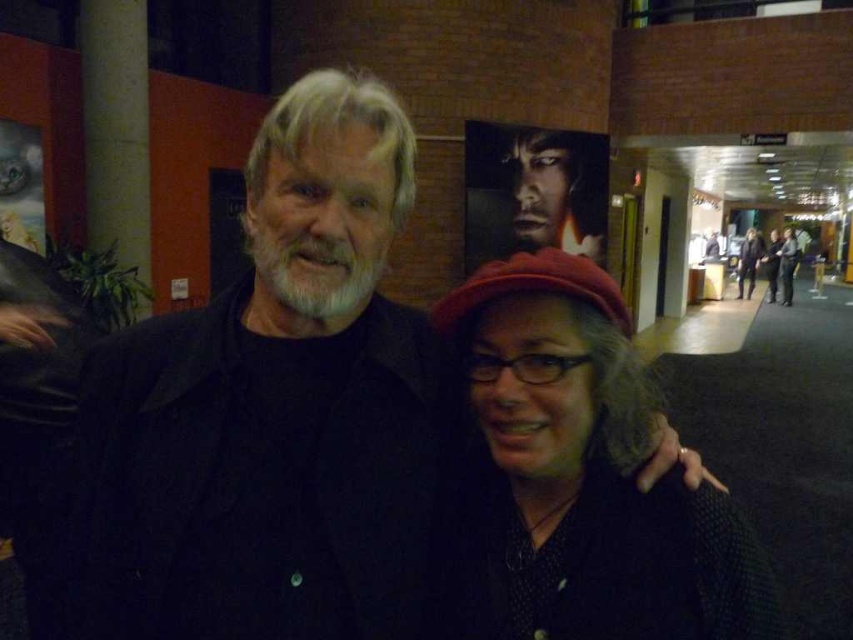
Who is more forward, [544,173] or [738,280]?

Point [544,173]

Between point (570, 141) and point (792, 246), which one is positioned in front?

Point (570, 141) is in front.

Where is `smooth black face at center`? This screenshot has width=853, height=640. smooth black face at center is located at coordinates (556, 192).

This screenshot has height=640, width=853. Describe the element at coordinates (579, 476) in the screenshot. I see `matte black sweater at center` at that location.

Does matte black sweater at center lie in front of dark gray sweater at center?

Yes, matte black sweater at center is closer to the viewer.

In the scene shown: Who is more forward, [637,522] or [776,228]?

Point [637,522] is in front.

Identify the location of matte black sweater at center. (579, 476).

Who is lower down, matte black sweater at center or smooth black face at center?

matte black sweater at center

Who is positioned more to the left, matte black sweater at center or smooth black face at center?

Positioned to the left is matte black sweater at center.

Locate an element on the screen. matte black sweater at center is located at coordinates (579, 476).